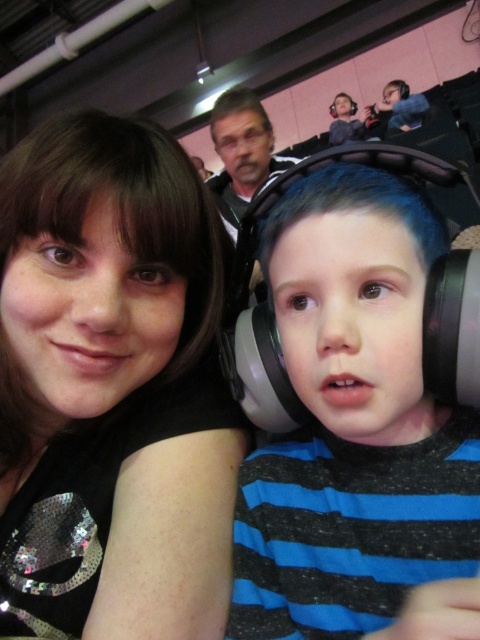
Does black sequined shirt at upper left appear on the right side of matte plastic headphones at center?

In fact, black sequined shirt at upper left is to the left of matte plastic headphones at center.

Is black sequined shirt at upper left further to the viewer compared to matte plastic headphones at center?

Yes, it is behind matte plastic headphones at center.

Is point (101, 422) farther from camera compared to point (265, 248)?

That is True.

Where is `black sequined shirt at upper left`? The height and width of the screenshot is (640, 480). black sequined shirt at upper left is located at coordinates 111,388.